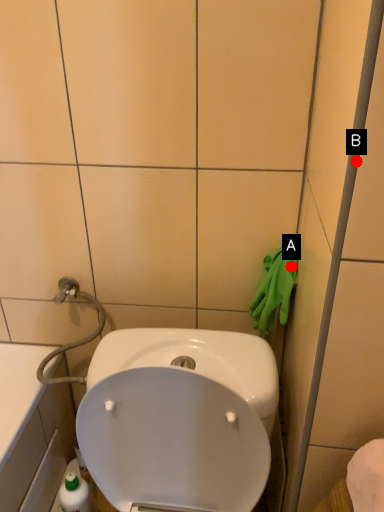
Question: Two points are circled on the image, labeled by A and B beside each circle. Which of the following is the farthest from the observer?

Choices:
 (A) A is further
 (B) B is further

Answer: (A)